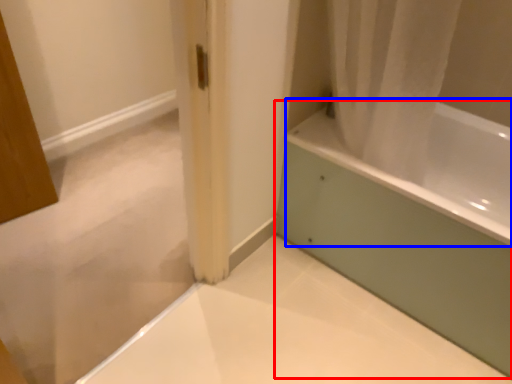
Question: Which point is closer to the camera, bathtub (highlighted by a red box) or bath (highlighted by a blue box)?

Choices:
 (A) bathtub
 (B) bath

Answer: (B)